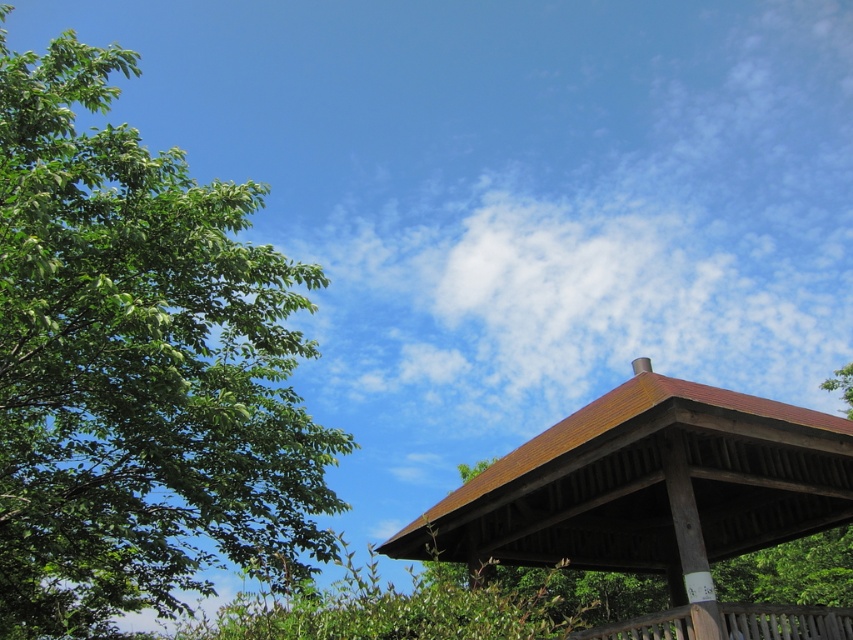
You are planning to set up a picnic blanket between the green leafy tree at left and the brown wooden gazebo at center. Which object should you place the blanket closer to if you want it to be under the shade of the tree but still within reach of the gazebo?

The green leafy tree at left might be wider than the brown wooden gazebo at center, so placing the blanket closer to the tree would ensure it stays under its shade while still being near the gazebo.

You are standing in the middle of the scene and want to walk towards the green leafy tree at left. Which direction should you move in relation to the brown wooden gazebo at center?

You should move to the left of the brown wooden gazebo at center because the green leafy tree at left is positioned to the left of the brown wooden gazebo at center.

You are standing in the outdoor scene and want to walk from the point at coordinates point (170, 588) to the point at coordinates point (712, 611). Which direction should you face to move towards the second point?

Since point (170, 588) is closer to you than point (712, 611), you should face away from yourself towards the point (712, 611) to move towards it.